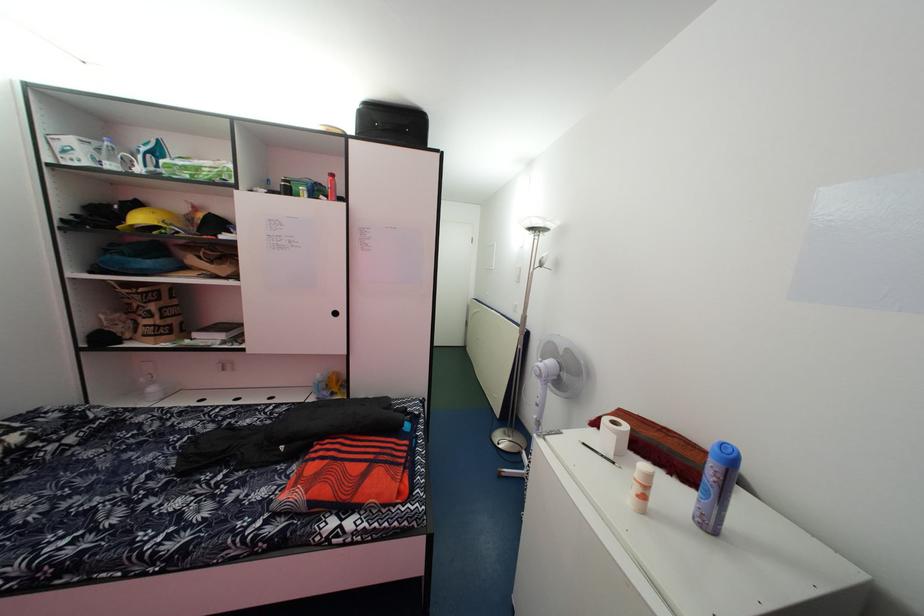
I want to click on black suitcase, so click(x=392, y=123).